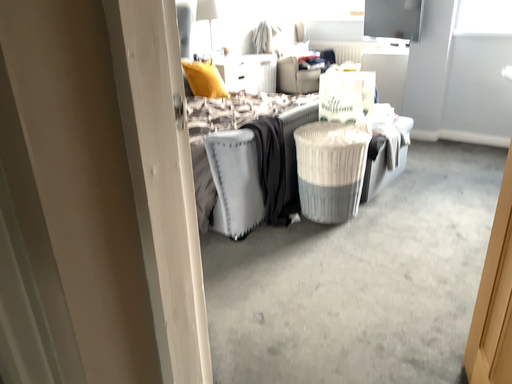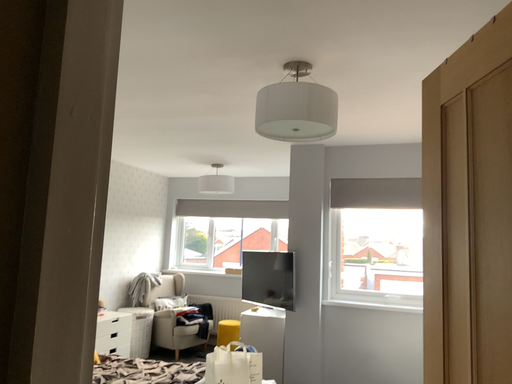
Question: Which way did the camera rotate in the video?

Choices:
 (A) rotated upward
 (B) rotated downward

Answer: (A)